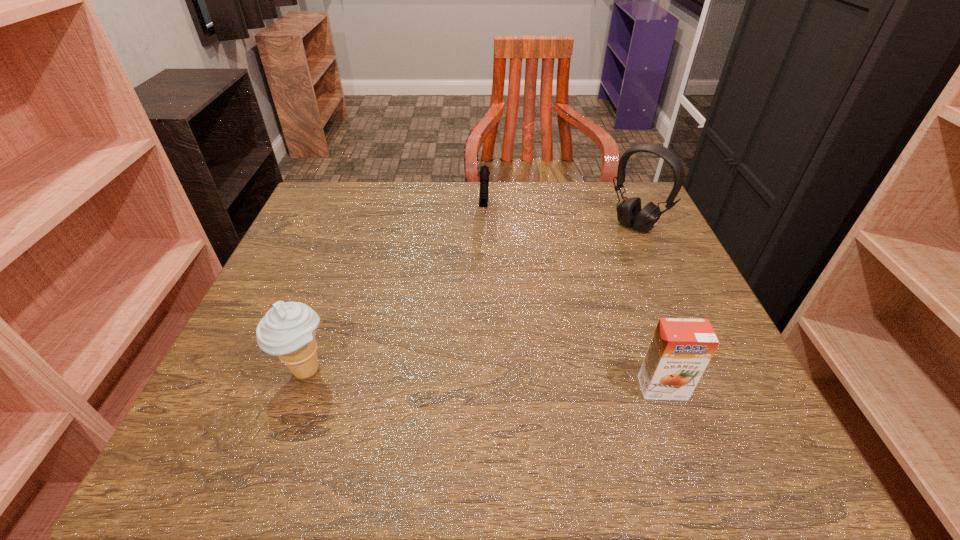
The image size is (960, 540). I want to click on free space on the desktop that is between the leftmost object and the third tallest object and is positioned on the front-facing side of the third object from right to left, so click(x=478, y=379).

Locate an element on the screen. The height and width of the screenshot is (540, 960). free space on the desktop that is between the leftmost object and the third tallest object and is positioned on the front-facing side of the headset is located at coordinates (x=468, y=379).